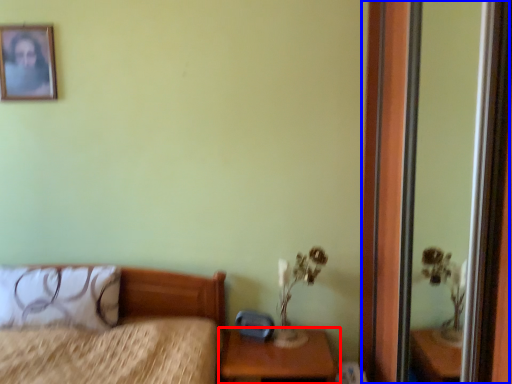
Question: Which of the following is the farthest to the observer, nightstand (highlighted by a red box) or screen door (highlighted by a blue box)?

Choices:
 (A) nightstand
 (B) screen door

Answer: (A)